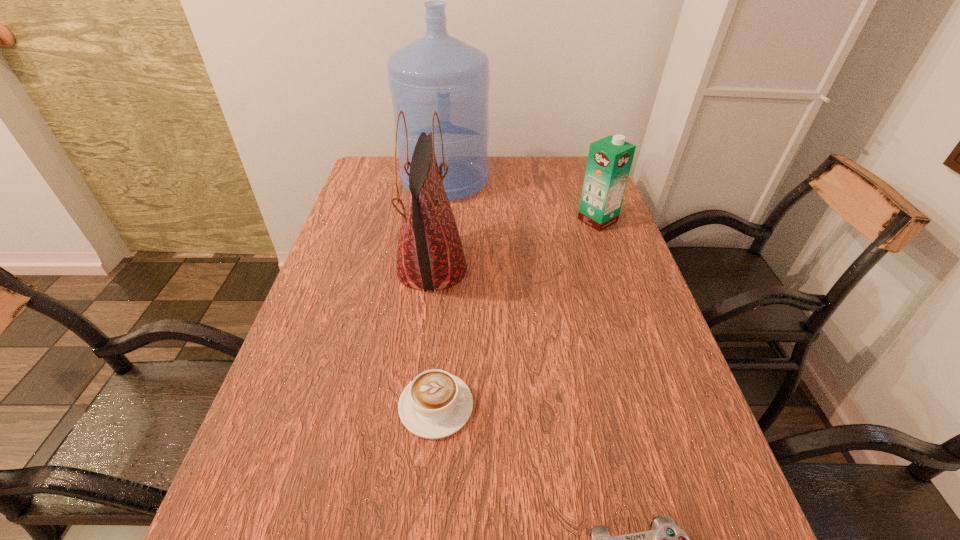
Find the location of a particular element. The width and height of the screenshot is (960, 540). object located at the far edge is located at coordinates (437, 72).

Locate an element on the screen. The image size is (960, 540). object present at the left edge is located at coordinates (437, 72).

This screenshot has height=540, width=960. Find the location of `object that is at the right edge`. object that is at the right edge is located at coordinates (609, 162).

Where is `object that is at the far left corner`? object that is at the far left corner is located at coordinates (437, 72).

Where is `free space at the far edge of the desktop`? This screenshot has width=960, height=540. free space at the far edge of the desktop is located at coordinates (511, 187).

I want to click on free space at the left edge of the desktop, so click(236, 515).

What are the coordinates of `free location at the right edge` in the screenshot? It's located at (622, 448).

The width and height of the screenshot is (960, 540). What are the coordinates of `vacant space at the far right corner` in the screenshot? It's located at (571, 189).

The width and height of the screenshot is (960, 540). In order to click on vacant area that lies between the cappuccino and the carton in this screenshot , I will do `click(516, 313)`.

You are a GUI agent. You are given a task and a screenshot of the screen. Output one action in this format:
    pyautogui.click(x=<x>, y=<y>)
    Task: Click on the free spot between the cappuccino and the handbag
    The image size is (960, 540).
    Given the screenshot: What is the action you would take?
    pyautogui.click(x=434, y=338)